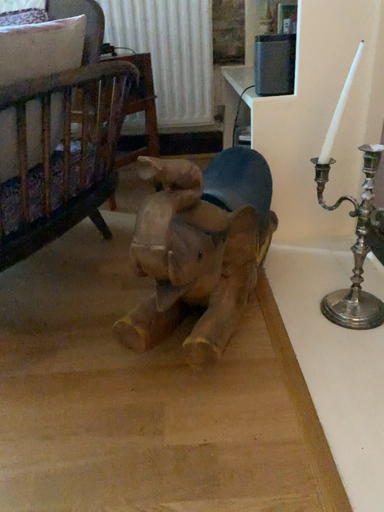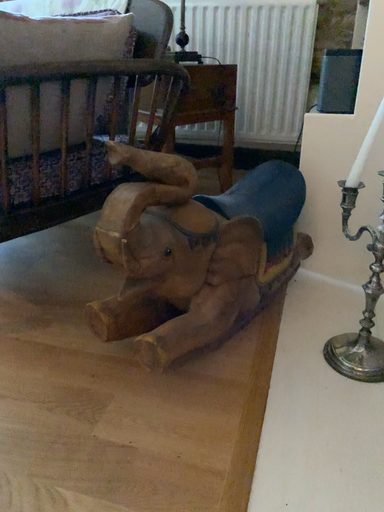
Question: How did the camera likely rotate when shooting the video?

Choices:
 (A) rotated left
 (B) rotated right

Answer: (A)